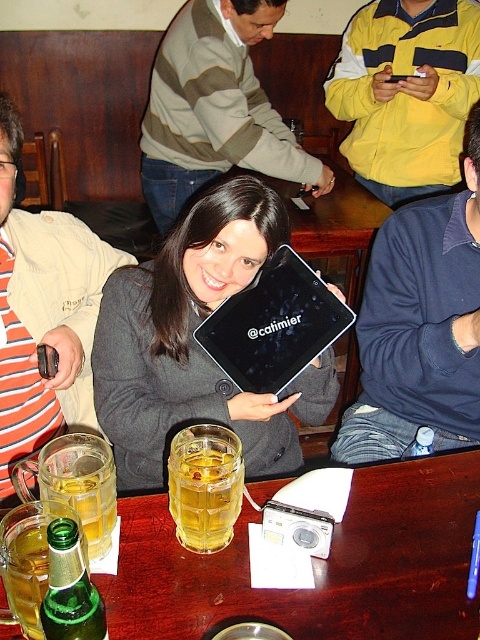
Question: Is striped sweater at center closer to the viewer compared to green glass bottle at lower left?

Choices:
 (A) no
 (B) yes

Answer: (A)

Question: Is matte black tablet at center behind translucent glass mug at center?

Choices:
 (A) no
 (B) yes

Answer: (B)

Question: Considering the real-world distances, which object is farthest from the striped sweater at center?

Choices:
 (A) wooden table at center
 (B) translucent glass mug at center

Answer: (A)

Question: Which point is farther from the camera taking this photo?

Choices:
 (A) (170, 106)
 (B) (429, 316)
 (C) (232, 304)
 (D) (199, 506)

Answer: (A)

Question: Which of the following is the closest to the observer?

Choices:
 (A) (268, 275)
 (B) (201, 157)

Answer: (A)

Question: Where is wooden table at center located in relation to dark blue sweater at center in the image?

Choices:
 (A) left
 (B) right

Answer: (A)